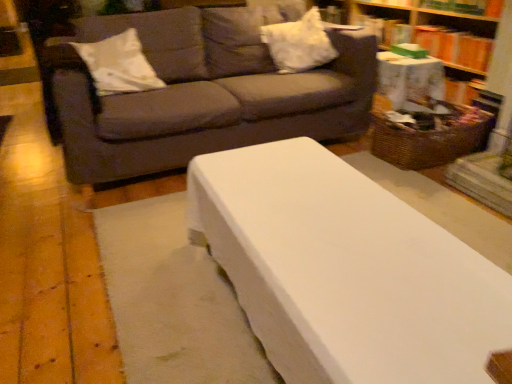
In the scene shown: What is the approximate height of wooden bookcase at right?

31.87 inches.

Identify the location of woven brown basket at right. This screenshot has height=384, width=512. (429, 136).

What is the approximate width of white fabric pillow at upper center, the 2th pillow when ordered from left to right?

It is 16.42 inches.

The image size is (512, 384). I want to click on dark gray fabric couch at upper center, so [201, 94].

From the image's perspective, is orange cardboard book at upper right located beneath white fabric pillow at upper center, the 2th pillow when ordered from left to right?

Incorrect, from the image's perspective, orange cardboard book at upper right is higher than white fabric pillow at upper center, the 2th pillow when ordered from left to right.

Is the position of orange cardboard book at upper right more distant than that of white fabric pillow at upper center, the 2th pillow when ordered from left to right?

That is True.

From a real-world perspective, who is located higher, orange cardboard book at upper right or white fabric pillow at upper center, the first pillow from the right?

white fabric pillow at upper center, the first pillow from the right, is physically above.

Considering the sizes of objects orange cardboard book at upper right and white fabric pillow at upper center, the 2th pillow when ordered from left to right, in the image provided, who is bigger, orange cardboard book at upper right or white fabric pillow at upper center, the 2th pillow when ordered from left to right,?

white fabric pillow at upper center, the 2th pillow when ordered from left to right, is bigger.

Is white soft pillow at upper left, which is the first pillow in left-to-right order, thinner than orange cardboard book at upper right?

No.

Looking at this image, could you tell me if white soft pillow at upper left, the second pillow when ordered from right to left, is turned towards orange cardboard book at upper right?

No, white soft pillow at upper left, the second pillow when ordered from right to left, is not turned towards orange cardboard book at upper right.

Is white soft pillow at upper left, which is the first pillow in left-to-right order, located outside orange cardboard book at upper right?

white soft pillow at upper left, which is the first pillow in left-to-right order, lies outside orange cardboard book at upper right's area.

Between dark gray fabric couch at upper center and white fabric pillow at upper center, the 2th pillow when ordered from left to right, which one has less height?

With less height is white fabric pillow at upper center, the 2th pillow when ordered from left to right.

Could white fabric pillow at upper center, the first pillow from the right, be considered to be inside dark gray fabric couch at upper center?

Yes, white fabric pillow at upper center, the first pillow from the right, is surrounded by dark gray fabric couch at upper center.

Does point (328, 139) come behind point (293, 26)?

No.

From the picture: Can you tell me how much dark gray fabric couch at upper center and white fabric pillow at upper center, the first pillow from the right, differ in facing direction?

The angular difference between dark gray fabric couch at upper center and white fabric pillow at upper center, the first pillow from the right, is 1.74 degrees.

From a real-world perspective, which is physically above, white fabric pillow at upper center, the 2th pillow when ordered from left to right, or wooden bookcase at right?

white fabric pillow at upper center, the 2th pillow when ordered from left to right, from a real-world perspective.

Based on their positions, is white fabric pillow at upper center, the first pillow from the right, located to the left or right of wooden bookcase at right?

Based on their positions, white fabric pillow at upper center, the first pillow from the right, is located to the left of wooden bookcase at right.

Is white fabric pillow at upper center, the 2th pillow when ordered from left to right, in contact with wooden bookcase at right?

They are not placed beside each other.

Does white fabric pillow at upper center, the first pillow from the right, have a greater width compared to wooden bookcase at right?

Yes.

From the image's perspective, count 1st pillows downward from the orange cardboard book at upper right and point to it. Please provide its 2D coordinates.

[(298, 43)]

Does white fabric pillow at upper center, the 2th pillow when ordered from left to right, have a lesser width compared to orange cardboard book at upper right?

Incorrect, the width of white fabric pillow at upper center, the 2th pillow when ordered from left to right, is not less than that of orange cardboard book at upper right.

Is white fabric pillow at upper center, the first pillow from the right, positioned far away from orange cardboard book at upper right?

No, white fabric pillow at upper center, the first pillow from the right, is in close proximity to orange cardboard book at upper right.

Is white fabric pillow at upper center, the first pillow from the right, inside or outside of orange cardboard book at upper right?

white fabric pillow at upper center, the first pillow from the right, is outside orange cardboard book at upper right.

Is woven brown basket at right situated inside white soft pillow at upper left, the second pillow when ordered from right to left, or outside?

woven brown basket at right cannot be found inside white soft pillow at upper left, the second pillow when ordered from right to left.

Is white soft pillow at upper left, the second pillow when ordered from right to left, at the back of woven brown basket at right?

No, woven brown basket at right is not facing away from white soft pillow at upper left, the second pillow when ordered from right to left.

How many degrees apart are the facing directions of woven brown basket at right and white soft pillow at upper left, which is the first pillow in left-to-right order?

The facing directions of woven brown basket at right and white soft pillow at upper left, which is the first pillow in left-to-right order, are 90.9 degrees apart.

Measure the distance from woven brown basket at right to white soft pillow at upper left, which is the first pillow in left-to-right order.

woven brown basket at right is 1.56 meters away from white soft pillow at upper left, which is the first pillow in left-to-right order.

Is white soft pillow at upper left, which is the first pillow in left-to-right order, far away from white fabric pillow at upper center, the 2th pillow when ordered from left to right?

No, white soft pillow at upper left, which is the first pillow in left-to-right order, is in close proximity to white fabric pillow at upper center, the 2th pillow when ordered from left to right.

Does white soft pillow at upper left, the second pillow when ordered from right to left, have a greater height compared to white fabric pillow at upper center, the first pillow from the right?

In fact, white soft pillow at upper left, the second pillow when ordered from right to left, may be shorter than white fabric pillow at upper center, the first pillow from the right.

Do you think white soft pillow at upper left, the second pillow when ordered from right to left, is within white fabric pillow at upper center, the 2th pillow when ordered from left to right, or outside of it?

white soft pillow at upper left, the second pillow when ordered from right to left, is spatially situated outside white fabric pillow at upper center, the 2th pillow when ordered from left to right.

You are a GUI agent. You are given a task and a screenshot of the screen. Output one action in this format:
    pyautogui.click(x=<x>, y=<y>)
    Task: Click on the 1st pillow in front of the orange cardboard book at upper right
    
    Given the screenshot: What is the action you would take?
    pyautogui.click(x=298, y=43)

Where is `the 2nd pillow counting from the left of the orange cardboard book at upper right`? The width and height of the screenshot is (512, 384). the 2nd pillow counting from the left of the orange cardboard book at upper right is located at coordinates (118, 64).

Looking at the image, which one is located closer to white soft pillow at upper left, which is the first pillow in left-to-right order, wooden bookcase at right or white fabric pillow at upper center, the first pillow from the right?

white fabric pillow at upper center, the first pillow from the right.

Which object lies nearer to the anchor point woven brown basket at right, dark gray fabric couch at upper center or white fabric pillow at upper center, the 2th pillow when ordered from left to right?

white fabric pillow at upper center, the 2th pillow when ordered from left to right, is closer to woven brown basket at right.

Considering their positions, is woven brown basket at right positioned closer to white fabric pillow at upper center, the 2th pillow when ordered from left to right, than white soft pillow at upper left, which is the first pillow in left-to-right order?

woven brown basket at right lies closer to white fabric pillow at upper center, the 2th pillow when ordered from left to right, than the other object.

From the image, which object appears to be nearer to woven brown basket at right, white soft pillow at upper left, the second pillow when ordered from right to left, or orange cardboard book at upper right?

orange cardboard book at upper right.

Which object lies nearer to the anchor point orange cardboard book at upper right, wooden bookcase at right or white soft pillow at upper left, the second pillow when ordered from right to left?

wooden bookcase at right.

Which object lies further to the anchor point orange cardboard book at upper right, woven brown basket at right or white soft pillow at upper left, the second pillow when ordered from right to left?

white soft pillow at upper left, the second pillow when ordered from right to left, lies further to orange cardboard book at upper right than the other object.

Estimate the real-world distances between objects in this image. Which object is further from white fabric pillow at upper center, the 2th pillow when ordered from left to right, orange cardboard book at upper right or white soft pillow at upper left, the second pillow when ordered from right to left?

white soft pillow at upper left, the second pillow when ordered from right to left.

Consider the image. Estimate the real-world distances between objects in this image. Which object is further from wooden bookcase at right, orange cardboard book at upper right or woven brown basket at right?

Based on the image, woven brown basket at right appears to be further to wooden bookcase at right.

Where is `pillow between white soft pillow at upper left, the second pillow when ordered from right to left, and woven brown basket at right from left to right`? The image size is (512, 384). pillow between white soft pillow at upper left, the second pillow when ordered from right to left, and woven brown basket at right from left to right is located at coordinates (298, 43).

At what (x,y) coordinates should I click in order to perform the action: click on basket situated between white fabric pillow at upper center, the 2th pillow when ordered from left to right, and wooden bookcase at right from left to right. Please return your answer as a coordinate pair (x, y). This screenshot has width=512, height=384. Looking at the image, I should click on (429, 136).

Where is `book between wooden bookcase at right and woven brown basket at right vertically`? book between wooden bookcase at right and woven brown basket at right vertically is located at coordinates (455, 46).

Locate an element on the screen. This screenshot has height=384, width=512. basket between white soft pillow at upper left, which is the first pillow in left-to-right order, and orange cardboard book at upper right, in the horizontal direction is located at coordinates (429, 136).